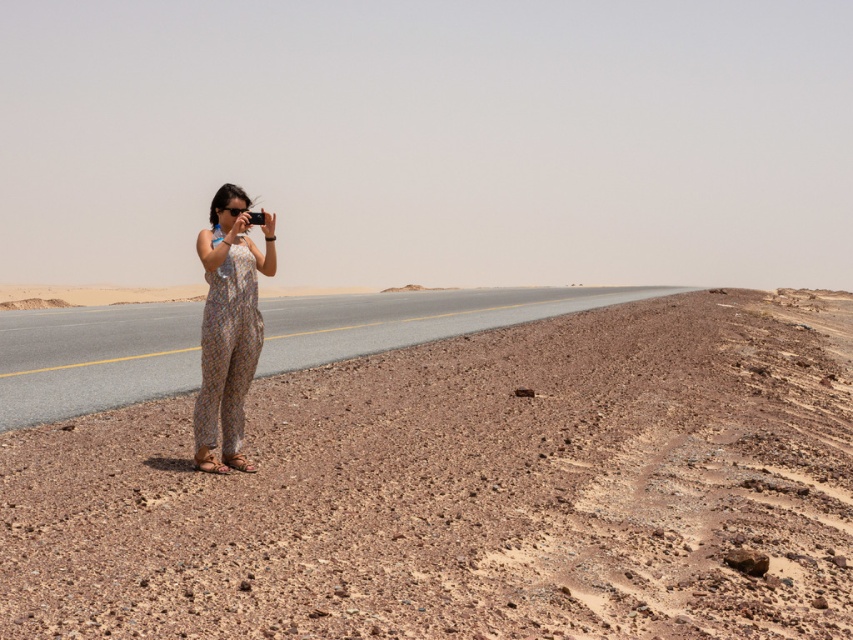
Between point (627, 516) and point (236, 385), which one is positioned in front?

Point (627, 516)

Is point (416, 454) farther from camera compared to point (259, 352)?

Yes, point (416, 454) is behind point (259, 352).

Where is `brown gravel desert at lower left`? The width and height of the screenshot is (853, 640). brown gravel desert at lower left is located at coordinates (468, 490).